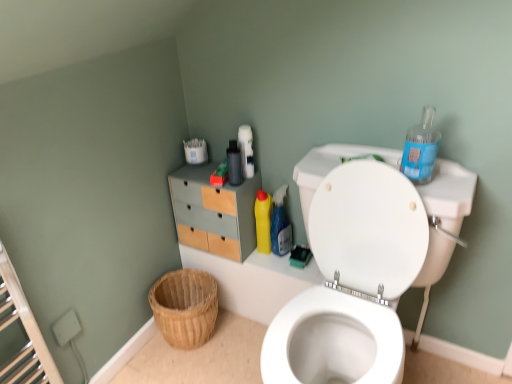
Question: Could you tell me if yellow plastic bottle at center, which is the first cleaning product in back-to-front order, is facing blue plastic bottle at upper right, the first cleaning product from the front?

Choices:
 (A) no
 (B) yes

Answer: (A)

Question: Is the depth of yellow plastic bottle at center, which is the first cleaning product in back-to-front order, greater than that of blue plastic bottle at upper right, placed as the 3th cleaning product when sorted from left to right?

Choices:
 (A) yes
 (B) no

Answer: (A)

Question: From a real-world perspective, is yellow plastic bottle at center, which is counted as the 3th cleaning product, starting from the right, on top of blue plastic bottle at upper right, which appears as the 3th cleaning product when viewed from the back?

Choices:
 (A) no
 (B) yes

Answer: (A)

Question: From the image's perspective, is yellow plastic bottle at center, which is the 3th cleaning product from front to back, below blue plastic bottle at upper right, placed as the 3th cleaning product when sorted from left to right?

Choices:
 (A) no
 (B) yes

Answer: (B)

Question: Is yellow plastic bottle at center, which is counted as the 3th cleaning product, starting from the right, outside of blue plastic bottle at upper right, arranged as the first cleaning product when viewed from the right?

Choices:
 (A) no
 (B) yes

Answer: (B)

Question: From a real-world perspective, is yellow plastic bottle at center, which is counted as the 3th cleaning product, starting from the right, located beneath blue plastic bottle at upper right, placed as the 3th cleaning product when sorted from left to right?

Choices:
 (A) no
 (B) yes

Answer: (B)

Question: Are blue plastic bottle at upper right, the first cleaning product from the front, and white glossy toilet at upper right far apart?

Choices:
 (A) yes
 (B) no

Answer: (B)

Question: Can you confirm if blue plastic bottle at upper right, arranged as the first cleaning product when viewed from the right, is wider than white glossy toilet at upper right?

Choices:
 (A) no
 (B) yes

Answer: (A)

Question: Does blue plastic bottle at upper right, placed as the 3th cleaning product when sorted from left to right, have a lesser width compared to white glossy toilet at upper right?

Choices:
 (A) no
 (B) yes

Answer: (B)

Question: From a real-world perspective, is blue plastic bottle at upper right, the first cleaning product from the front, on white glossy toilet at upper right?

Choices:
 (A) no
 (B) yes

Answer: (B)

Question: Considering the relative sizes of blue plastic bottle at upper right, placed as the 3th cleaning product when sorted from left to right, and white glossy toilet at upper right in the image provided, is blue plastic bottle at upper right, placed as the 3th cleaning product when sorted from left to right, taller than white glossy toilet at upper right?

Choices:
 (A) no
 (B) yes

Answer: (A)

Question: From a real-world perspective, is blue plastic bottle at upper right, placed as the 3th cleaning product when sorted from left to right, under white glossy toilet at upper right?

Choices:
 (A) yes
 (B) no

Answer: (B)

Question: Is blue plastic bottle at upper right, which appears as the 3th cleaning product when viewed from the back, to the right of matte black bottle at upper center from the viewer's perspective?

Choices:
 (A) no
 (B) yes

Answer: (B)